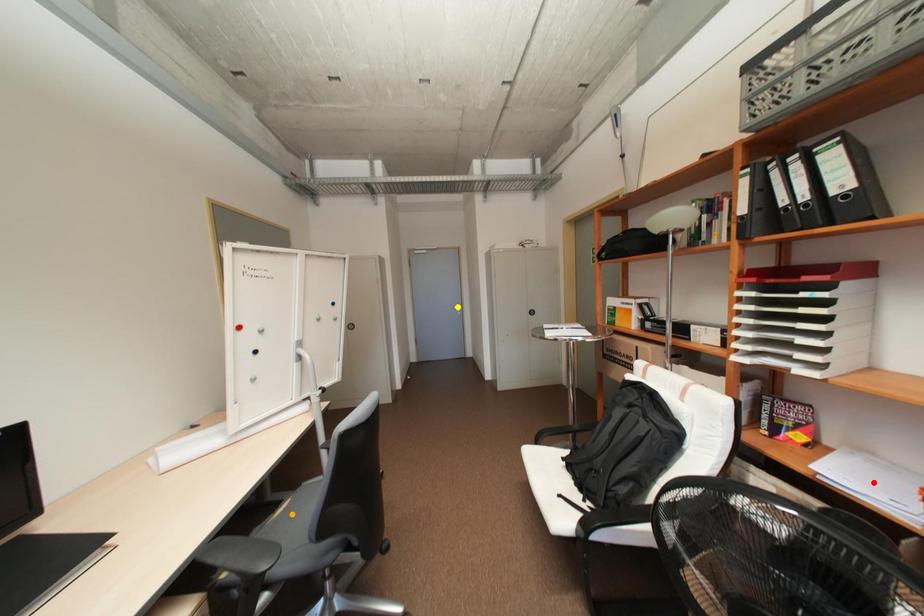
Consider the image. Order these from nearest to farthest:
A) orange point
B) yellow point
C) red point

yellow point
orange point
red point